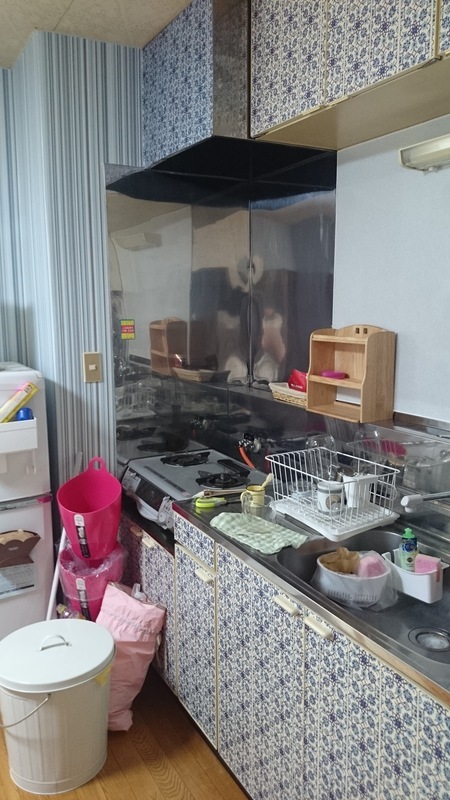
This screenshot has width=450, height=800. I want to click on cabinet handle, so click(134, 533), click(146, 542), click(202, 574), click(286, 602), click(323, 632).